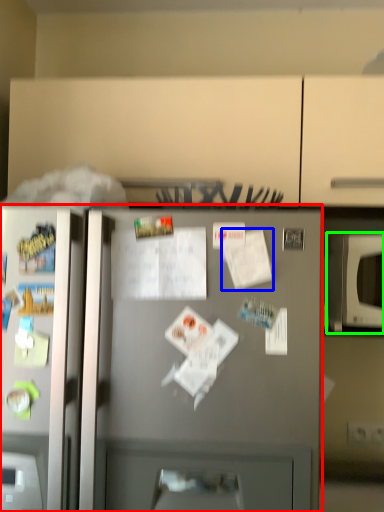
Question: Which object is positioned closest to refrigerator (highlighted by a red box)? Select from paper (highlighted by a blue box) and microwave oven (highlighted by a green box).

Choices:
 (A) paper
 (B) microwave oven

Answer: (A)